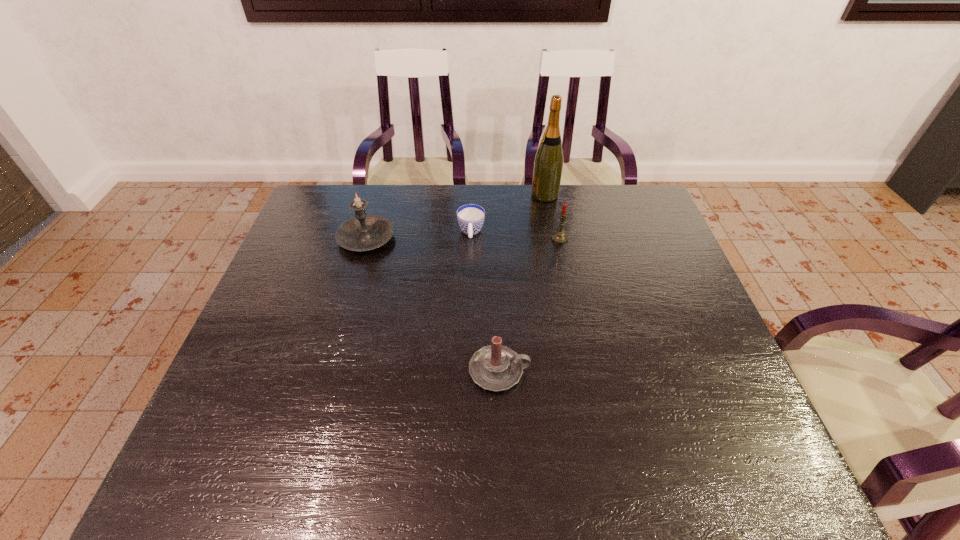
You are a GUI agent. You are given a task and a screenshot of the screen. Output one action in this format:
    pyautogui.click(x=<x>, y=<y>)
    Task: Click on the free region located on the front-facing side of the wine bottle
    Image resolution: width=960 pixels, height=540 pixels.
    Given the screenshot: What is the action you would take?
    (x=514, y=195)

You are a GUI agent. You are given a task and a screenshot of the screen. Output one action in this format:
    pyautogui.click(x=<x>, y=<y>)
    Task: Click on the free space located on the front of the leftmost candle
    
    Given the screenshot: What is the action you would take?
    pyautogui.click(x=341, y=329)

The height and width of the screenshot is (540, 960). In order to click on vacant position located on the front of the rightmost candle in this screenshot , I will do `click(564, 258)`.

The image size is (960, 540). I want to click on vacant region located 0.050m on the side of the second candle from left to right with the handle loop, so click(551, 371).

What are the coordinates of `vacant space located 0.110m on the side of the cup with the handle` in the screenshot? It's located at (470, 271).

Image resolution: width=960 pixels, height=540 pixels. I want to click on wine bottle located at the far edge, so click(x=548, y=164).

At what (x,y) coordinates should I click in order to perform the action: click on candle that is at the far edge. Please return your answer as a coordinate pair (x, y). The height and width of the screenshot is (540, 960). Looking at the image, I should click on (363, 232).

Identify the location of cup positioned at the far edge. (470, 217).

Find the location of `object at the left edge`. object at the left edge is located at coordinates (363, 232).

Identify the location of object situated at the far left corner. This screenshot has height=540, width=960. (363, 232).